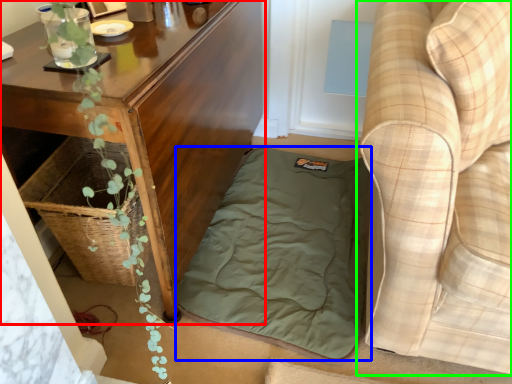
Question: Based on their relative distances, which object is farther from table (highlighted by a red box)? Choose from mattress (highlighted by a blue box) and studio couch (highlighted by a green box).

Choices:
 (A) mattress
 (B) studio couch

Answer: (B)